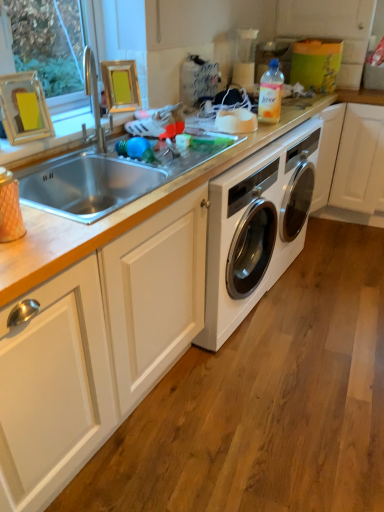
Where is `white glossy washing machine at center`? The image size is (384, 512). white glossy washing machine at center is located at coordinates (256, 228).

Describe the element at coordinates (86, 187) in the screenshot. I see `silver metallic sink at upper left` at that location.

This screenshot has height=512, width=384. I want to click on white matte cabinet at center, so click(x=95, y=348).

Would you say silver metallic sink at upper left is inside or outside white matte cabinet at center?

silver metallic sink at upper left exists outside the volume of white matte cabinet at center.

Between silver metallic sink at upper left and white matte cabinet at center, which one appears on the left side from the viewer's perspective?

Positioned to the left is silver metallic sink at upper left.

Is silver metallic sink at upper left oriented away from white matte cabinet at center?

No, silver metallic sink at upper left's orientation is not away from white matte cabinet at center.

Consider the image. Is silver metallic sink at upper left looking in the opposite direction of white glossy washing machine at center?

silver metallic sink at upper left is not turned away from white glossy washing machine at center.

Considering the sizes of silver metallic sink at upper left and white glossy washing machine at center in the image, is silver metallic sink at upper left taller or shorter than white glossy washing machine at center?

In the image, silver metallic sink at upper left appears to be shorter than white glossy washing machine at center.

Is silver metallic sink at upper left bigger or smaller than white glossy washing machine at center?

silver metallic sink at upper left is smaller than white glossy washing machine at center.

Is silver metallic sink at upper left at the right side of white glossy washing machine at center?

In fact, silver metallic sink at upper left is to the left of white glossy washing machine at center.

Do you think silver metallic sink at upper left is within translucent plastic bottle at upper right, or outside of it?

silver metallic sink at upper left is not inside translucent plastic bottle at upper right, it's outside.

Is silver metallic sink at upper left taller than translucent plastic bottle at upper right?

Indeed, silver metallic sink at upper left has a greater height compared to translucent plastic bottle at upper right.

Between point (45, 192) and point (267, 114), which one is positioned behind?

The point (267, 114) is behind.

Is silver metallic sink at upper left thinner than translucent plastic bottle at upper right?

Incorrect, the width of silver metallic sink at upper left is not less than that of translucent plastic bottle at upper right.

Considering the relative positions of white glossy washing machine at center and translucent plastic bottle at upper right in the image provided, is white glossy washing machine at center to the right of translucent plastic bottle at upper right from the viewer's perspective?

Incorrect, white glossy washing machine at center is not on the right side of translucent plastic bottle at upper right.

Looking at this image, is white glossy washing machine at center aimed at translucent plastic bottle at upper right?

No, white glossy washing machine at center is not facing towards translucent plastic bottle at upper right.

From a real-world perspective, which is physically above, white glossy washing machine at center or translucent plastic bottle at upper right?

translucent plastic bottle at upper right is physically above.

From the image's perspective, does white glossy washing machine at center appear lower than translucent plastic bottle at upper right?

Yes.

Is white matte cabinet at center looking in the opposite direction of translucent plastic bottle at upper right?

white matte cabinet at center does not have its back to translucent plastic bottle at upper right.

Locate an element on the screen. This screenshot has width=384, height=512. bottle that appears behind the white matte cabinet at center is located at coordinates (270, 93).

Does white matte cabinet at center come in front of translucent plastic bottle at upper right?

Yes.

In terms of width, does white matte cabinet at center look wider or thinner when compared to white glossy washing machine at center?

Considering their sizes, white matte cabinet at center looks broader than white glossy washing machine at center.

Who is smaller, white matte cabinet at center or white glossy washing machine at center?

white matte cabinet at center is smaller.

Is white matte cabinet at center oriented towards white glossy washing machine at center?

No, white matte cabinet at center is not facing towards white glossy washing machine at center.

Is point (226, 222) positioned behind point (81, 401)?

Yes, point (226, 222) is farther from viewer.

Relative to white matte cabinet at center, is white glossy washing machine at center in front or behind?

white glossy washing machine at center is behind white matte cabinet at center.

Does white glossy washing machine at center contain white matte cabinet at center?

Definitely not — white matte cabinet at center is not inside white glossy washing machine at center.

Could you tell me if white glossy washing machine at center is turned towards white matte cabinet at center?

No, white glossy washing machine at center does not turn towards white matte cabinet at center.

Identify the location of sink on the left of white matte cabinet at center. tap(86, 187).

The height and width of the screenshot is (512, 384). In the image, there is a white glossy washing machine at center. What are the coordinates of `sink above it (from the image's perspective)` in the screenshot? It's located at (86, 187).

Estimate the real-world distances between objects in this image. Which object is further from silver metallic sink at upper left, white matte cabinet at center or translucent plastic bottle at upper right?

translucent plastic bottle at upper right lies further to silver metallic sink at upper left than the other object.

Estimate the real-world distances between objects in this image. Which object is further from white glossy washing machine at center, silver metallic sink at upper left or translucent plastic bottle at upper right?

silver metallic sink at upper left is further to white glossy washing machine at center.

When comparing their distances from white glossy washing machine at center, does silver metallic sink at upper left or white matte cabinet at center seem closer?

The object closer to white glossy washing machine at center is white matte cabinet at center.

Estimate the real-world distances between objects in this image. Which object is further from translucent plastic bottle at upper right, white matte cabinet at center or silver metallic sink at upper left?

Among the two, white matte cabinet at center is located further to translucent plastic bottle at upper right.

Estimate the real-world distances between objects in this image. Which object is closer to translucent plastic bottle at upper right, white matte cabinet at center or white glossy washing machine at center?

Based on the image, white glossy washing machine at center appears to be nearer to translucent plastic bottle at upper right.

When comparing their distances from white glossy washing machine at center, does white matte cabinet at center or silver metallic sink at upper left seem further?

Among the two, silver metallic sink at upper left is located further to white glossy washing machine at center.

Based on their spatial positions, is silver metallic sink at upper left or white matte cabinet at center further from translucent plastic bottle at upper right?

The object further to translucent plastic bottle at upper right is white matte cabinet at center.

Estimate the real-world distances between objects in this image. Which object is closer to translucent plastic bottle at upper right, white glossy washing machine at center or silver metallic sink at upper left?

The object closer to translucent plastic bottle at upper right is white glossy washing machine at center.

Image resolution: width=384 pixels, height=512 pixels. I want to click on sink between white matte cabinet at center and white glossy washing machine at center from front to back, so click(x=86, y=187).

Find the location of a particular element. The image size is (384, 512). sink between translucent plastic bottle at upper right and white matte cabinet at center vertically is located at coordinates (86, 187).

Identify the location of washing machine situated between silver metallic sink at upper left and translucent plastic bottle at upper right from left to right. [x=256, y=228].

You are a GUI agent. You are given a task and a screenshot of the screen. Output one action in this format:
    pyautogui.click(x=<x>, y=<y>)
    Task: Click on the bottle between white matte cabinet at center and white glossy washing machine at center along the z-axis
    
    Given the screenshot: What is the action you would take?
    pyautogui.click(x=270, y=93)